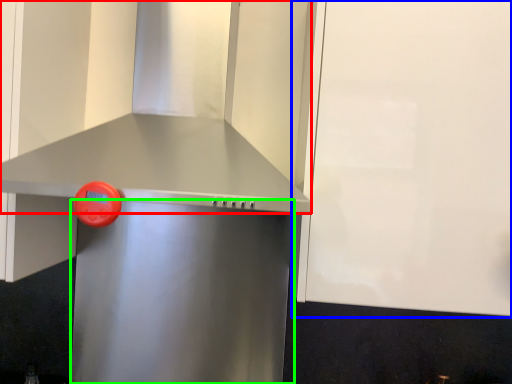
Question: Considering the real-world distances, which object is closest to vent (highlighted by a red box)? cabinetry (highlighted by a blue box) or appliance (highlighted by a green box).

Choices:
 (A) cabinetry
 (B) appliance

Answer: (A)